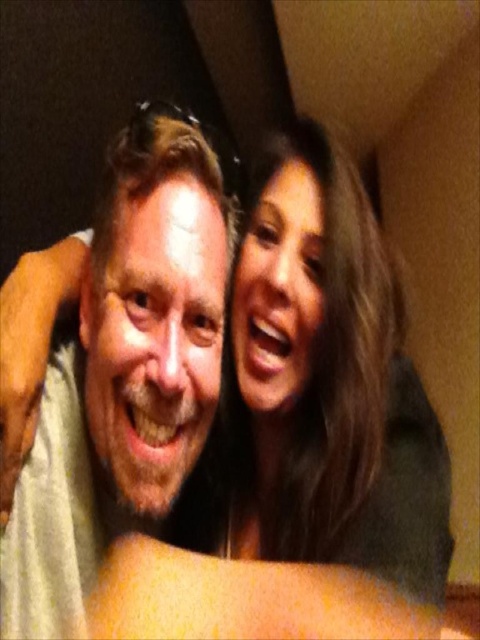
Question: Which point appears closest to the camera in this image?

Choices:
 (A) (380, 444)
 (B) (175, 339)

Answer: (B)

Question: Which object is farther from the camera taking this photo?

Choices:
 (A) smooth brown hair at upper right
 (B) white matte shirt at center

Answer: (A)

Question: Is the position of smooth brown hair at upper right less distant than that of white matte shirt at center?

Choices:
 (A) no
 (B) yes

Answer: (A)

Question: Does smooth brown hair at upper right appear on the left side of white matte shirt at center?

Choices:
 (A) no
 (B) yes

Answer: (A)

Question: Is smooth brown hair at upper right behind white matte shirt at center?

Choices:
 (A) yes
 (B) no

Answer: (A)